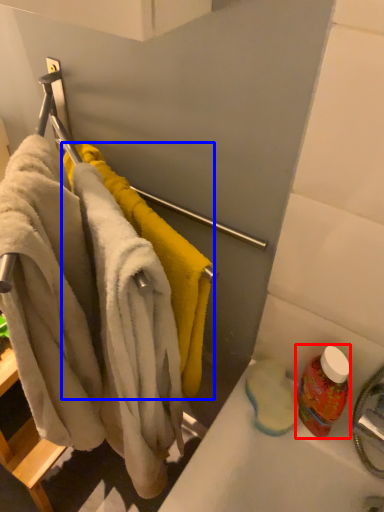
Question: Which object appears farthest to the camera in this image, cleaning product (highlighted by a red box) or towel (highlighted by a blue box)?

Choices:
 (A) cleaning product
 (B) towel

Answer: (A)